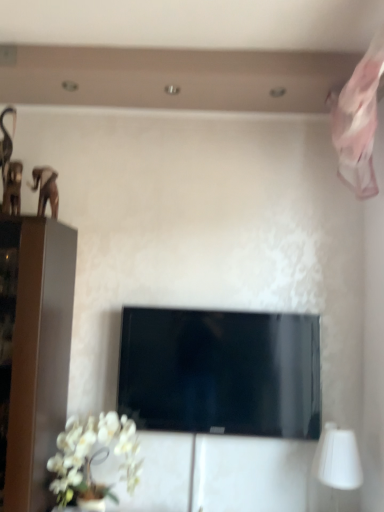
Question: Is white matte orchid at lower left looking in the opposite direction of black glossy tv at center?

Choices:
 (A) no
 (B) yes

Answer: (A)

Question: Would you say white matte orchid at lower left is outside black glossy tv at center?

Choices:
 (A) yes
 (B) no

Answer: (A)

Question: Is white matte orchid at lower left touching black glossy tv at center?

Choices:
 (A) yes
 (B) no

Answer: (B)

Question: Can you confirm if white matte orchid at lower left is wider than black glossy tv at center?

Choices:
 (A) yes
 (B) no

Answer: (A)

Question: Does white matte orchid at lower left turn towards black glossy tv at center?

Choices:
 (A) yes
 (B) no

Answer: (B)

Question: From their relative heights in the image, would you say white matte orchid at lower left is taller or shorter than white matte table lamp at lower right?

Choices:
 (A) short
 (B) tall

Answer: (B)

Question: Is white matte orchid at lower left wider or thinner than white matte table lamp at lower right?

Choices:
 (A) thin
 (B) wide

Answer: (B)

Question: Based on their positions, is white matte orchid at lower left located to the left or right of white matte table lamp at lower right?

Choices:
 (A) left
 (B) right

Answer: (A)

Question: Considering their positions, is white matte orchid at lower left located in front of or behind white matte table lamp at lower right?

Choices:
 (A) front
 (B) behind

Answer: (A)

Question: In the image, is black glossy tv at center positioned in front of or behind white matte orchid at lower left?

Choices:
 (A) behind
 (B) front

Answer: (A)

Question: In terms of height, does black glossy tv at center look taller or shorter compared to white matte orchid at lower left?

Choices:
 (A) short
 (B) tall

Answer: (B)

Question: Is black glossy tv at center situated inside white matte orchid at lower left or outside?

Choices:
 (A) inside
 (B) outside

Answer: (B)

Question: Considering the positions of black glossy tv at center and white matte orchid at lower left in the image, is black glossy tv at center bigger or smaller than white matte orchid at lower left?

Choices:
 (A) small
 (B) big

Answer: (B)

Question: From a real-world perspective, relative to black glossy tv at center, is white matte table lamp at lower right vertically above or below?

Choices:
 (A) below
 (B) above

Answer: (A)

Question: Looking at the image, does white matte table lamp at lower right seem bigger or smaller compared to black glossy tv at center?

Choices:
 (A) big
 (B) small

Answer: (B)